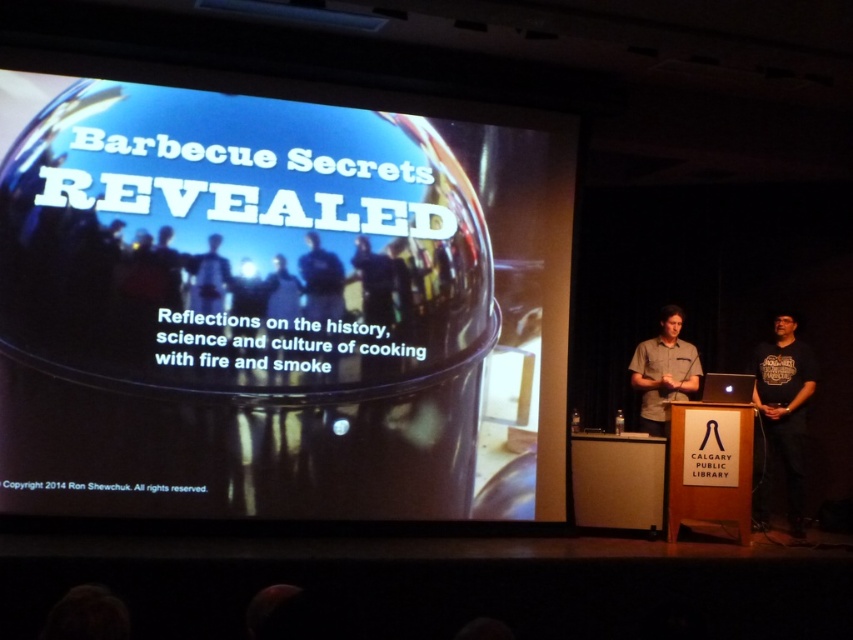
Question: Does matte gray shirt at center lie behind matte black person at center?

Choices:
 (A) no
 (B) yes

Answer: (B)

Question: Does matte gray shirt at center have a smaller size compared to matte black person at center?

Choices:
 (A) yes
 (B) no

Answer: (B)

Question: Among these points, which one is nearest to the camera?

Choices:
 (A) (x=209, y=262)
 (B) (x=646, y=349)

Answer: (A)

Question: Based on their relative distances, which object is farther from the black cotton t-shirt at right?

Choices:
 (A) glossy black barbecue grill at center
 (B) matte black person at center
 (C) matte gray shirt at center

Answer: (B)

Question: Which point is closer to the camera?

Choices:
 (A) glossy black barbecue grill at center
 (B) matte gray shirt at center
 (C) black cotton t-shirt at right
 (D) matte black person at center

Answer: (A)

Question: Does glossy black barbecue grill at center appear on the right side of black cotton t-shirt at right?

Choices:
 (A) yes
 (B) no

Answer: (B)